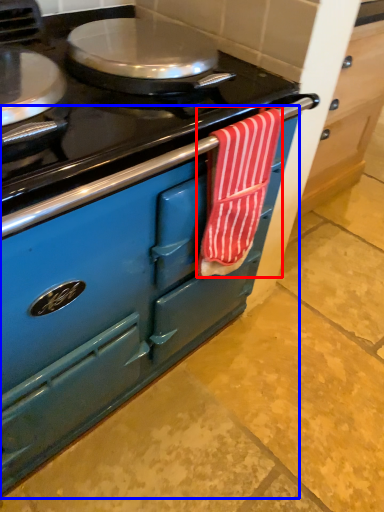
Question: Which object appears closest to the camera in this image, beach towel (highlighted by a red box) or cabinetry (highlighted by a blue box)?

Choices:
 (A) beach towel
 (B) cabinetry

Answer: (B)